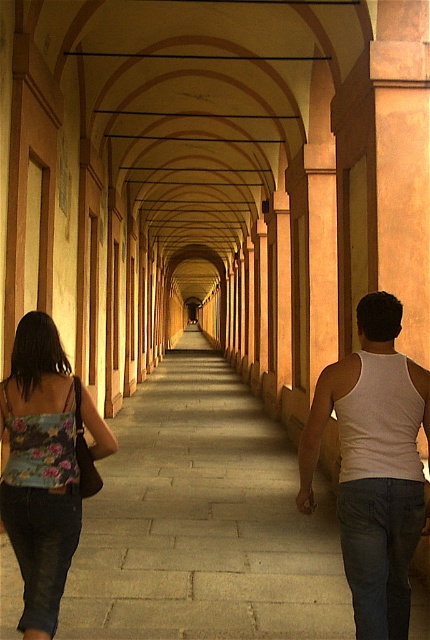
Can you confirm if white tank top at center is positioned below floral fabric tank top at lower left?

Actually, white tank top at center is above floral fabric tank top at lower left.

Can you confirm if white tank top at center is smaller than floral fabric tank top at lower left?

Correct, white tank top at center occupies less space than floral fabric tank top at lower left.

The height and width of the screenshot is (640, 430). Find the location of `white tank top at center`. white tank top at center is located at coordinates (374, 465).

Is gray stone pavement at center thinner than floral fabric tank top at lower left?

Incorrect, gray stone pavement at center's width is not less than floral fabric tank top at lower left's.

The height and width of the screenshot is (640, 430). Find the location of `gray stone pavement at center`. gray stone pavement at center is located at coordinates (203, 522).

Describe the element at coordinates (203, 522) in the screenshot. I see `gray stone pavement at center` at that location.

Between gray stone pavement at center and white tank top at center, which one appears on the right side from the viewer's perspective?

white tank top at center is more to the right.

This screenshot has width=430, height=640. What do you see at coordinates (203, 522) in the screenshot?
I see `gray stone pavement at center` at bounding box center [203, 522].

The height and width of the screenshot is (640, 430). Find the location of `gray stone pavement at center`. gray stone pavement at center is located at coordinates (203, 522).